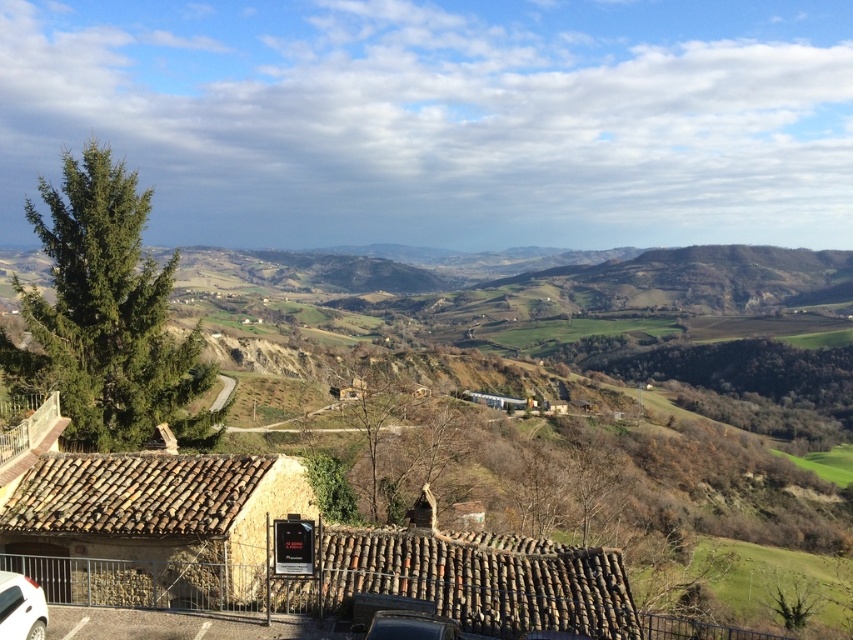
You are a delivery driver who needs to park your truck between the white glossy car at lower left and the shiny black car at lower center. The truck is 7 meters long. Can you fit it in the space between them?

The white glossy car at lower left is 6.94 meters from the shiny black car at lower center. Since the truck is 7 meters long, it cannot fit in the space between them as the distance is slightly shorter than the truck.

You are a delivery driver who needs to park your vehicle in this area. You see a white glossy car at lower left and a shiny black car at lower center. Can you park your truck between them without overlapping either car?

The white glossy car at lower left is positioned over shiny black car at lower center, meaning there is no space between them for your truck to park without overlapping either car.

You are a photographer planning to capture both the white glossy car at lower left and the shiny black car at lower center in a single shot. Given their positions and sizes, which car will appear larger in the photo?

The white glossy car at lower left will appear larger in the photo because it is much taller than the shiny black car at lower center.